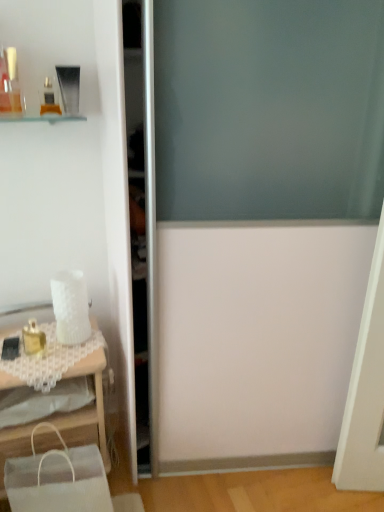
Where is `free space in front of gold metallic perfume at left, which is the first toiletry from bottom to top`? free space in front of gold metallic perfume at left, which is the first toiletry from bottom to top is located at coordinates (34, 362).